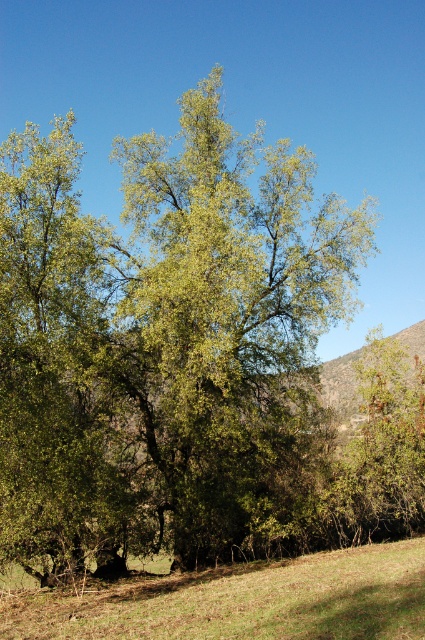
You are standing in the middle of the green grassy field at lower center. Looking towards the green leafy tree at center, which direction should you walk to reach it?

The green leafy tree at center is to the right of your current position in the green grassy field at lower center, so you should walk towards the right to reach it.

You are planning to set up a picnic blanket for a group of 10 people. The green grassy field at lower center is your only option for the blanket. Considering the space occupied by the green leafy tree at center, will there be enough room for the group to comfortably spread out without being under the tree?

The green leafy tree at center might be wider than the green grassy field at lower center, so there may not be enough space for the group of 10 to comfortably spread out without being under the tree.

You are standing in front of the tree and looking at two points marked on the image. The first point is at coordinates point [61,460], and the second point is at point [421,572]. Which point is closer to you?

Point [61,460] is closer to you because it is further to the camera than point [421,572], meaning it is nearer in the viewing perspective.